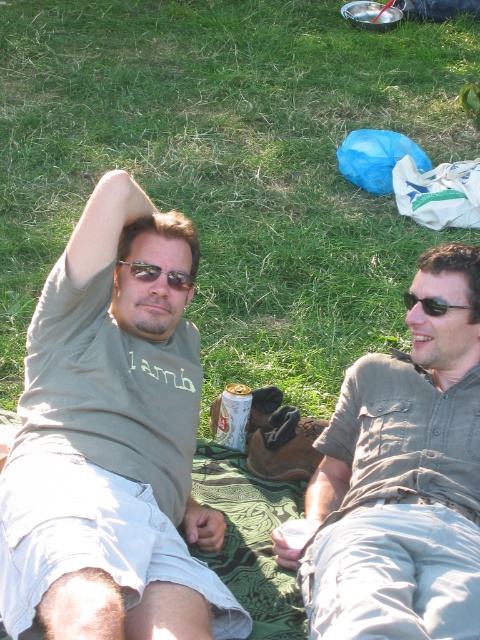
Which of these two, gold metallic can at center or matte black sunglasses at upper left, stands shorter?

Standing shorter between the two is matte black sunglasses at upper left.

Which is in front, point (222, 410) or point (155, 273)?

Point (155, 273) is in front.

Measure the distance between gold metallic can at center and camera.

gold metallic can at center and camera are 9.40 feet apart.

Where is `gold metallic can at center`? gold metallic can at center is located at coordinates (233, 416).

Can you confirm if green grass at upper center is bigger than black plastic sunglasses at right?

Yes.

In the scene shown: Does green grass at upper center appear under black plastic sunglasses at right?

No.

Image resolution: width=480 pixels, height=640 pixels. In order to click on green grass at upper center in this screenshot , I will do `click(230, 164)`.

Does point (215, 548) lie in front of point (431, 284)?

Yes, point (215, 548) is closer to viewer.

Does matte khaki shirt at upper left have a greater height compared to matte khaki shirt at center?

Correct, matte khaki shirt at upper left is much taller as matte khaki shirt at center.

Where is `matte khaki shirt at upper left`? This screenshot has height=640, width=480. matte khaki shirt at upper left is located at coordinates click(x=111, y=444).